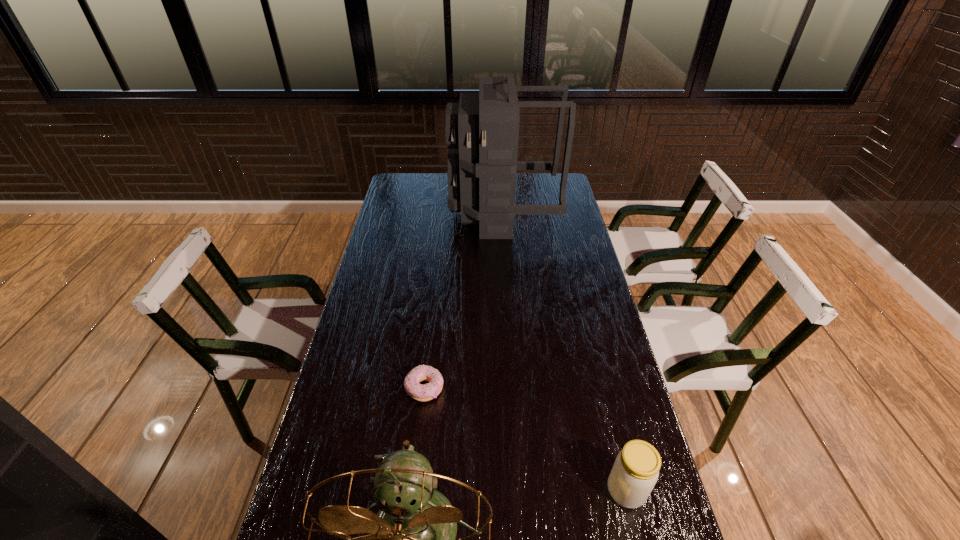
Locate an element on the screen. backpack is located at coordinates (482, 131).

Locate an element on the screen. the farthest object is located at coordinates (482, 131).

Where is `jar`? Image resolution: width=960 pixels, height=540 pixels. jar is located at coordinates (635, 472).

Find the location of `the second farthest object`. the second farthest object is located at coordinates (425, 392).

Locate an element on the screen. This screenshot has height=540, width=960. doughnut is located at coordinates (425, 392).

What are the coordinates of `free space located 0.220m on the front compartment of the tallest object` in the screenshot? It's located at (400, 213).

Locate an element on the screen. The image size is (960, 540). vacant space situated 0.150m on the front compartment of the tallest object is located at coordinates (416, 213).

Locate an element on the screen. The width and height of the screenshot is (960, 540). vacant space situated 0.070m on the front compartment of the tallest object is located at coordinates (434, 213).

Where is `free region located on the left of the third tallest object`? The image size is (960, 540). free region located on the left of the third tallest object is located at coordinates (511, 490).

Where is `free region located on the back of the shortest object`? The height and width of the screenshot is (540, 960). free region located on the back of the shortest object is located at coordinates (433, 318).